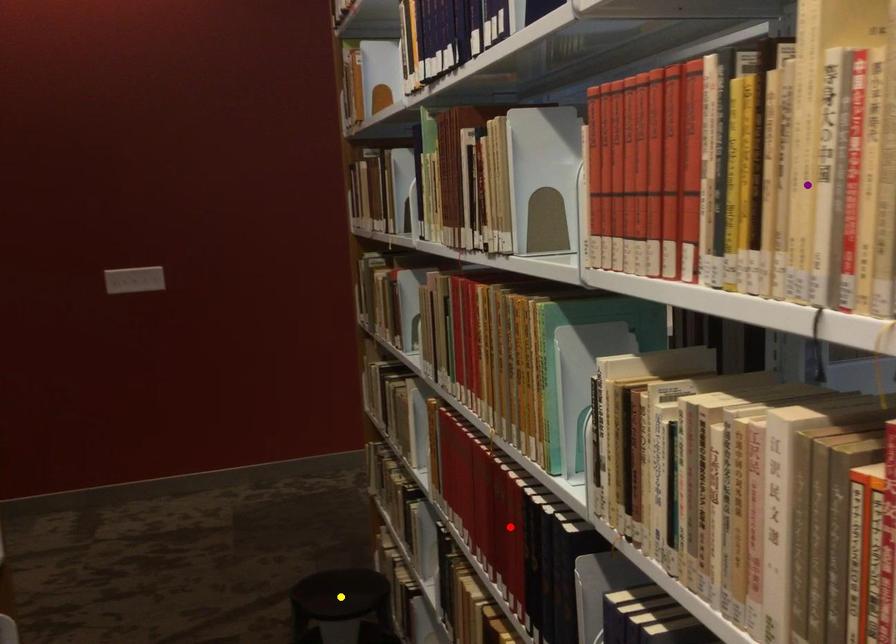
Order these from nearest to farthest:
purple point | red point | yellow point

purple point, red point, yellow point